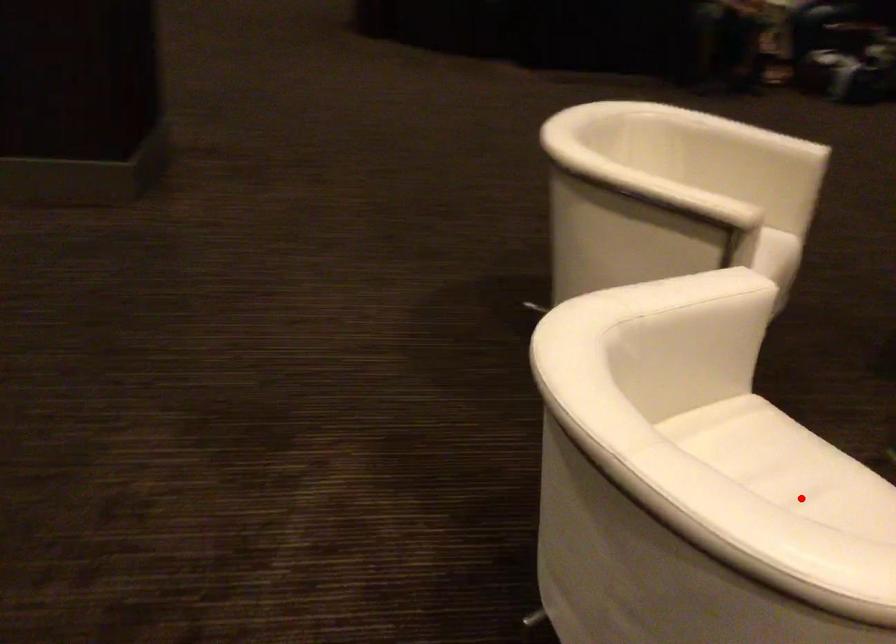
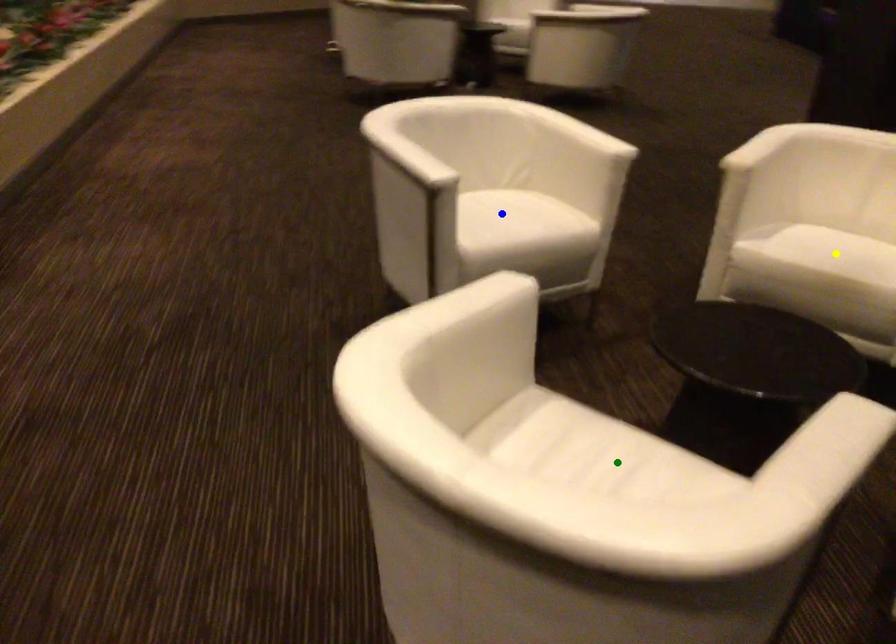
Question: I am providing you with two images of the same scene from different viewpoints. A red point is marked on the first image. You are given multiple points on the second image. Which point in image 2 represents the same 3d spot as the red point in image 1?

Choices:
 (A) blue point
 (B) green point
 (C) yellow point

Answer: (A)